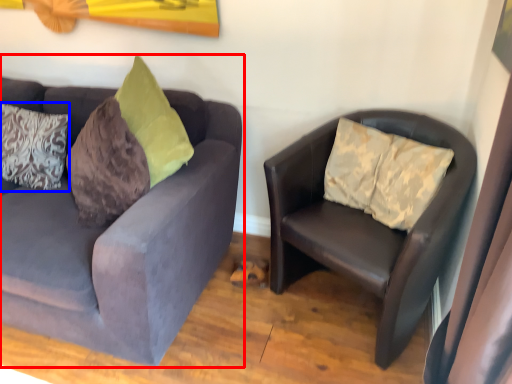
Question: Which object appears closest to the camera in this image, studio couch (highlighted by a red box) or pillow (highlighted by a blue box)?

Choices:
 (A) studio couch
 (B) pillow

Answer: (A)